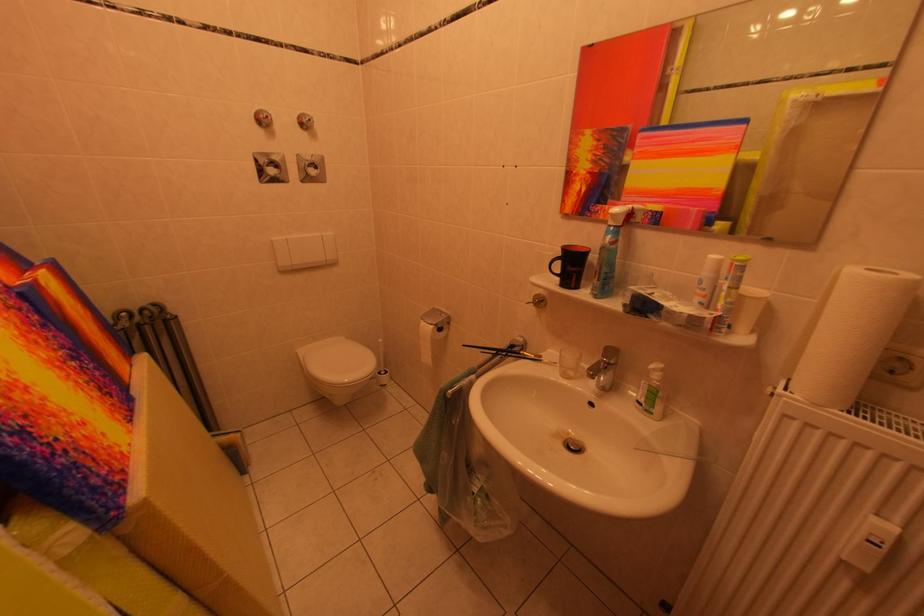
Find where to lift the black paintbrush. Please return your answer as a coordinate pair (x, y).

(508, 353)